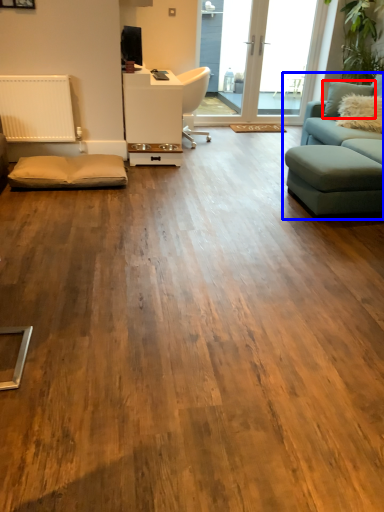
Question: Among these objects, which one is farthest to the camera, pillow (highlighted by a red box) or studio couch (highlighted by a blue box)?

Choices:
 (A) pillow
 (B) studio couch

Answer: (A)